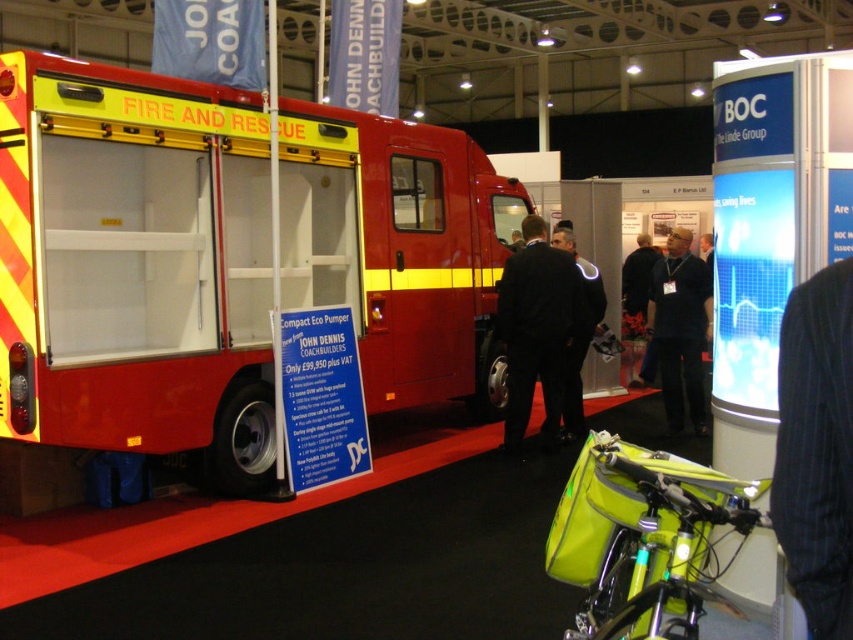
Question: Which object appears closest to the camera in this image?

Choices:
 (A) dark blue shirt at center
 (B) neon yellow fabric bag at lower right
 (C) black fabric suit at center
 (D) black fabric jacket at center

Answer: (B)

Question: Is neon yellow fabric bag at lower right bigger than black fabric suit at center?

Choices:
 (A) no
 (B) yes

Answer: (A)

Question: Which point is farther to the camera?

Choices:
 (A) (573, 394)
 (B) (624, 468)
 (C) (683, 352)
 (D) (364, 221)

Answer: (C)

Question: Estimate the real-world distances between objects in this image. Which object is farther from the black fabric suit at center?

Choices:
 (A) black fabric jacket at center
 (B) red matte fire truck at center

Answer: (B)

Question: Can you confirm if red matte fire truck at center is positioned to the left of neon yellow fabric bag at lower right?

Choices:
 (A) no
 (B) yes

Answer: (B)

Question: Is red matte fire truck at center positioned behind black fabric jacket at center?

Choices:
 (A) no
 (B) yes

Answer: (A)